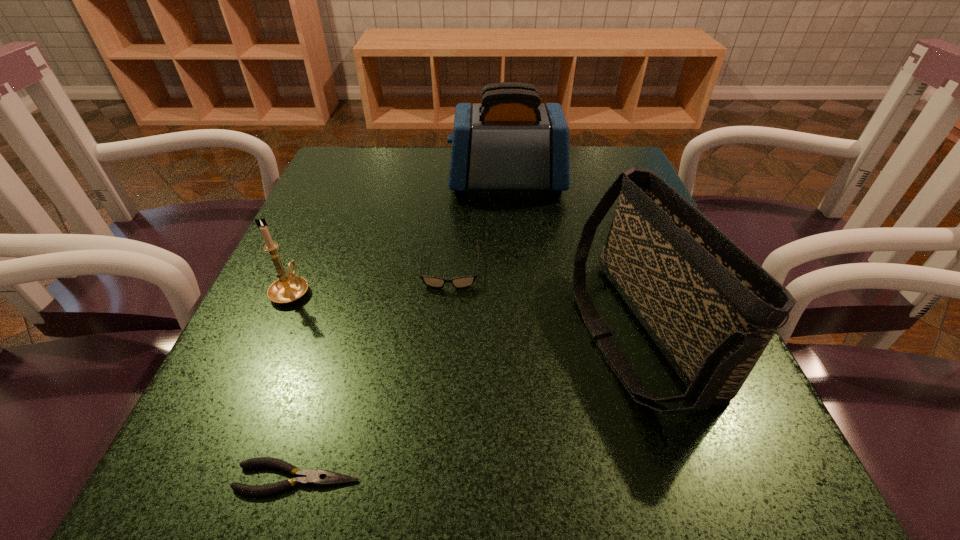
I want to click on toaster, so click(510, 141).

What are the coordinates of `handbag` in the screenshot? It's located at (711, 309).

Where is `the leftmost object`? the leftmost object is located at coordinates (287, 289).

Locate an element on the screen. The width and height of the screenshot is (960, 540). the third tallest object is located at coordinates (287, 289).

At what (x,y) coordinates should I click in order to perform the action: click on sunglasses. Please return your answer as a coordinate pair (x, y). Looking at the image, I should click on (463, 281).

Image resolution: width=960 pixels, height=540 pixels. What are the coordinates of `the nearest object` in the screenshot? It's located at (307, 477).

Locate an element on the screen. the shortest object is located at coordinates [x=307, y=477].

The image size is (960, 540). Find the location of `vacant space positioned on the front-facing side of the toaster`. vacant space positioned on the front-facing side of the toaster is located at coordinates (375, 183).

Locate an element on the screen. This screenshot has width=960, height=540. vacant space located 0.060m on the front-facing side of the toaster is located at coordinates (423, 183).

Locate an element on the screen. This screenshot has height=540, width=960. vacant space situated 0.060m on the front-facing side of the toaster is located at coordinates (423, 183).